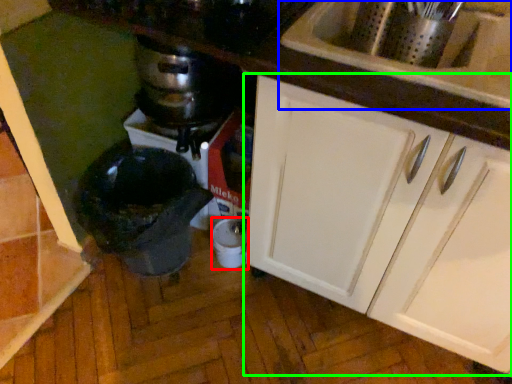
Question: Which is nearer to the appliance (highlighted by a red box)? sink (highlighted by a blue box) or cabinetry (highlighted by a green box).

Choices:
 (A) sink
 (B) cabinetry

Answer: (B)